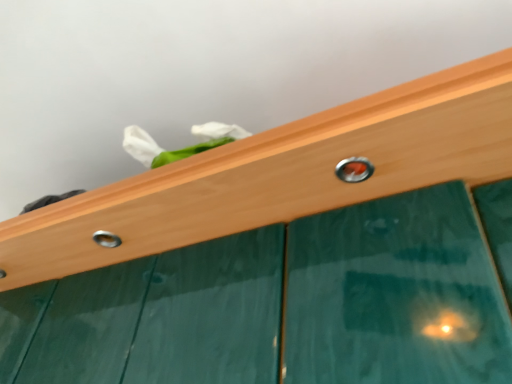
The width and height of the screenshot is (512, 384). Find the location of `metallic silver bolt at center`. metallic silver bolt at center is located at coordinates (354, 169).

The image size is (512, 384). Describe the element at coordinates (354, 169) in the screenshot. I see `metallic silver bolt at center` at that location.

This screenshot has width=512, height=384. Find the location of `metallic silver bolt at center`. metallic silver bolt at center is located at coordinates (354, 169).